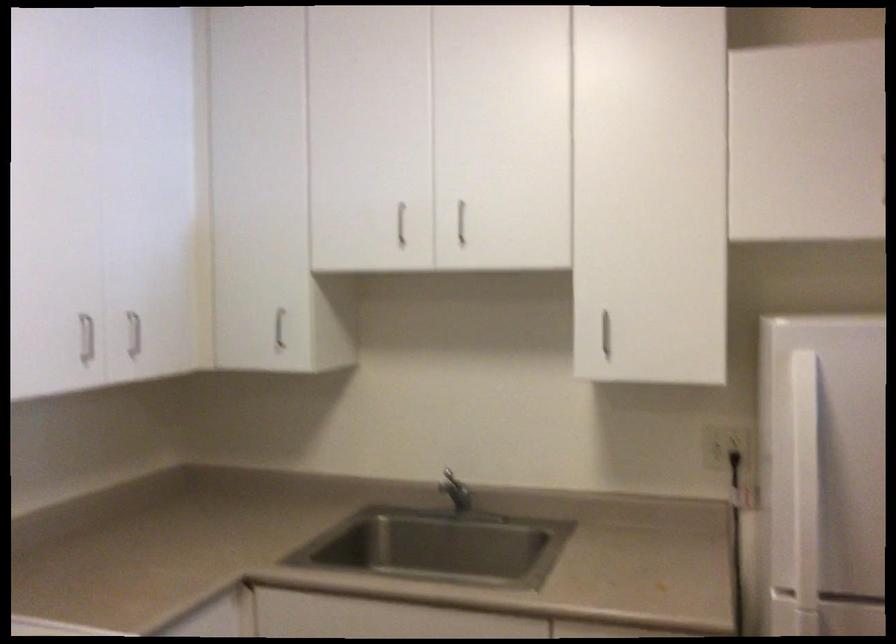
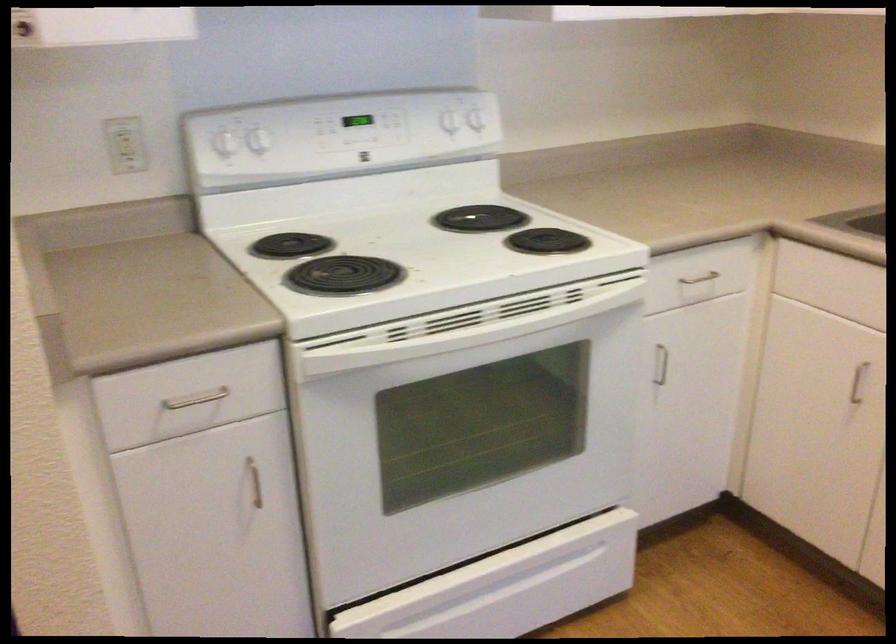
First-person continuous shooting, in which direction is the camera rotating?

The camera's rotation is toward left-down.